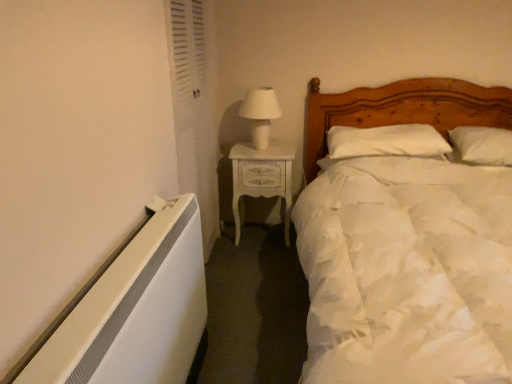
Question: Does white glossy table lamp at upper center have a lesser width compared to white louvered door at left?

Choices:
 (A) yes
 (B) no

Answer: (B)

Question: From a real-world perspective, is white glossy table lamp at upper center located beneath white louvered door at left?

Choices:
 (A) no
 (B) yes

Answer: (A)

Question: Can you confirm if white glossy table lamp at upper center is shorter than white louvered door at left?

Choices:
 (A) yes
 (B) no

Answer: (A)

Question: Is white glossy table lamp at upper center positioned behind white louvered door at left?

Choices:
 (A) yes
 (B) no

Answer: (A)

Question: Is white glossy table lamp at upper center outside white louvered door at left?

Choices:
 (A) yes
 (B) no

Answer: (A)

Question: Does white glossy table lamp at upper center turn towards white louvered door at left?

Choices:
 (A) yes
 (B) no

Answer: (B)

Question: Is white soft pillow at upper right, the 1th pillow in the right-to-left sequence, surrounding white painted wood nightstand at center?

Choices:
 (A) no
 (B) yes

Answer: (A)

Question: Is white soft pillow at upper right, which is the second pillow in left-to-right order, thinner than white painted wood nightstand at center?

Choices:
 (A) yes
 (B) no

Answer: (B)

Question: Considering the relative positions of white soft pillow at upper right, the 1th pillow in the right-to-left sequence, and white painted wood nightstand at center in the image provided, is white soft pillow at upper right, the 1th pillow in the right-to-left sequence, behind white painted wood nightstand at center?

Choices:
 (A) yes
 (B) no

Answer: (B)

Question: Is white soft pillow at upper right, the 1th pillow in the right-to-left sequence, positioned before white painted wood nightstand at center?

Choices:
 (A) yes
 (B) no

Answer: (A)

Question: Does white soft pillow at upper right, which is the second pillow in left-to-right order, have a smaller size compared to white painted wood nightstand at center?

Choices:
 (A) no
 (B) yes

Answer: (B)

Question: From the image's perspective, is white soft pillow at upper right, which is the second pillow in left-to-right order, under white painted wood nightstand at center?

Choices:
 (A) no
 (B) yes

Answer: (A)

Question: Is the depth of white glossy table lamp at upper center greater than that of white soft pillow at upper right, which is the second pillow in left-to-right order?

Choices:
 (A) no
 (B) yes

Answer: (B)